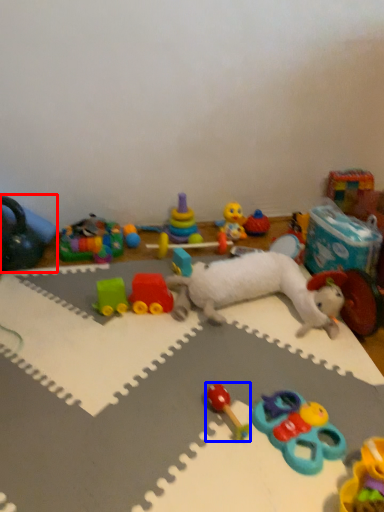
Question: Which point is further to the camera, toy (highlighted by a red box) or toy (highlighted by a blue box)?

Choices:
 (A) toy
 (B) toy

Answer: (A)